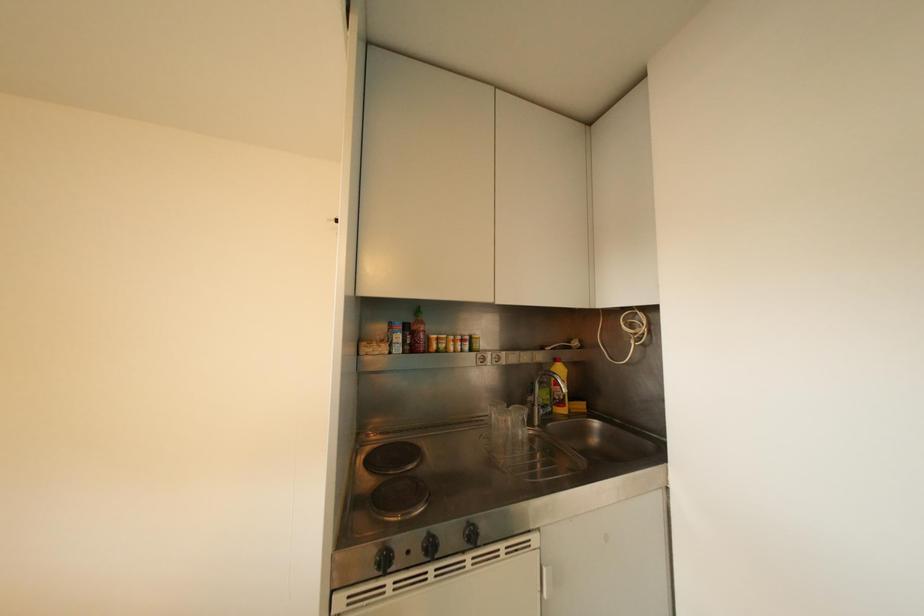
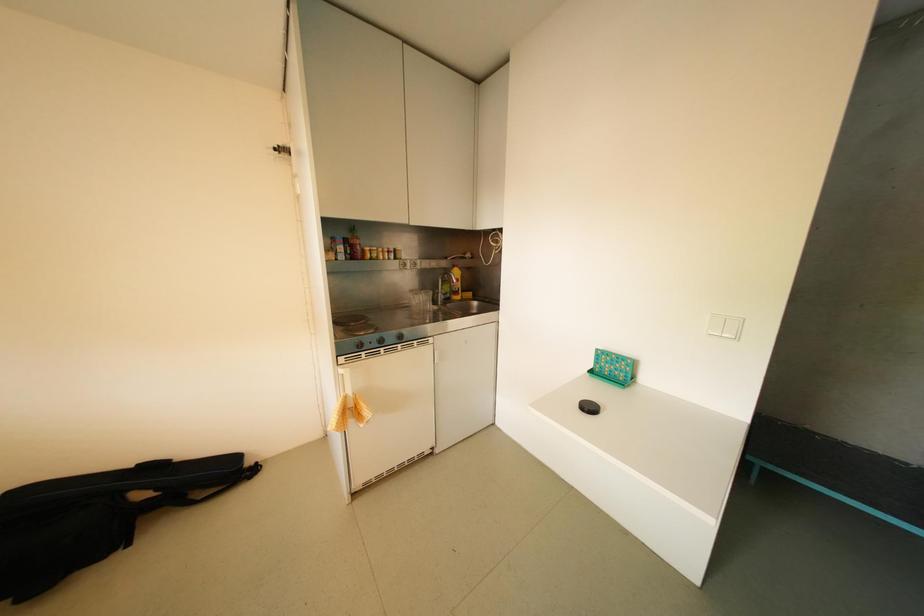
The first image is from the beginning of the video and the second image is from the end. How did the camera likely rotate when shooting the video?

The camera's rotation is toward right-down.